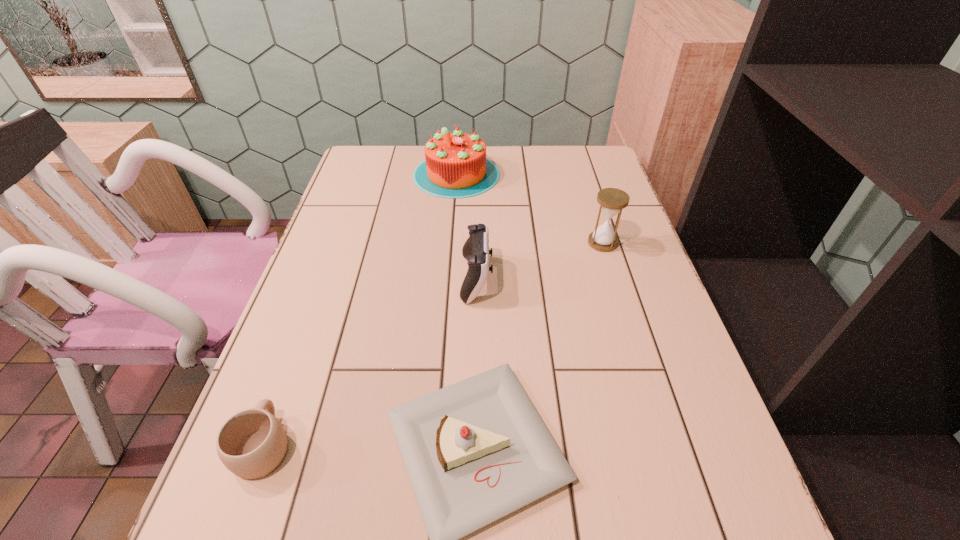
This screenshot has height=540, width=960. Identify the location of vacant area that lies between the third tallest object and the second farthest object. (540, 261).

Image resolution: width=960 pixels, height=540 pixels. In order to click on vacant area between the second farthest object and the control in this screenshot , I will do `click(540, 261)`.

Image resolution: width=960 pixels, height=540 pixels. Find the location of `vacant space in between the farthest object and the third tallest object`. vacant space in between the farthest object and the third tallest object is located at coordinates (467, 226).

What are the coordinates of `free point between the hourglass and the leftmost object` in the screenshot? It's located at (433, 344).

Where is `empty space that is in between the third farthest object and the farthest object`? This screenshot has width=960, height=540. empty space that is in between the third farthest object and the farthest object is located at coordinates (467, 226).

I want to click on vacant area between the third tallest object and the hourglass, so click(x=540, y=261).

Identify which object is located as the third nearest to the rightmost object. Please provide its 2D coordinates. Your answer should be formatted as a tuple, i.e. [(x, y)], where the tuple contains the x and y coordinates of a point satisfying the conditions above.

[(475, 451)]

Locate which object ranks third in proximity to the nearer cake. Please provide its 2D coordinates. Your answer should be formatted as a tuple, i.e. [(x, y)], where the tuple contains the x and y coordinates of a point satisfying the conditions above.

[(612, 201)]

Find the location of a particular element. free point that satisfies the following two spatial constraints: 1. on the side of the leftmost object with the handle; 2. on the left side of the rightmost object is located at coordinates (337, 243).

Locate an element on the screen. This screenshot has height=540, width=960. blank space that satisfies the following two spatial constraints: 1. on the front side of the rightmost object; 2. on the front-facing side of the third tallest object is located at coordinates (613, 279).